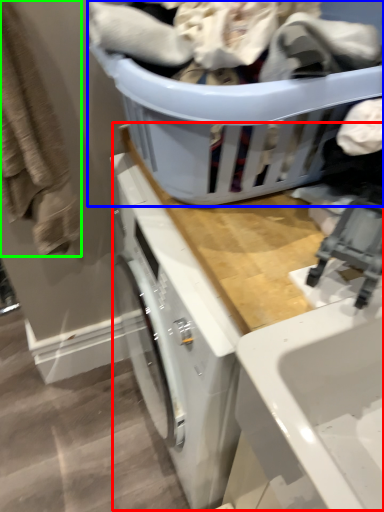
Question: Which object is the farthest from counter top (highlighted by a red box)? Choose among these: basket (highlighted by a blue box) or clothing (highlighted by a green box).

Choices:
 (A) basket
 (B) clothing

Answer: (B)